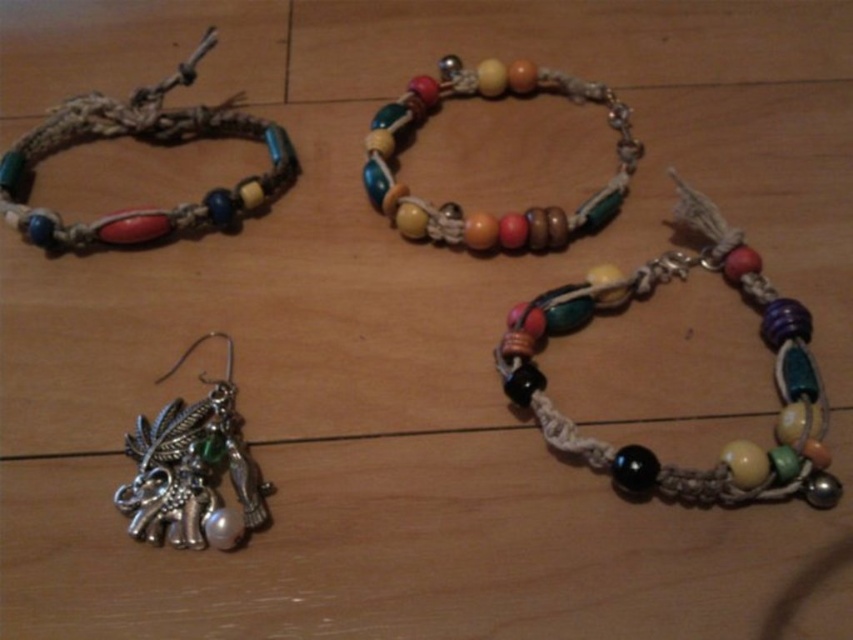
You are an artisan arranging jewelry on a wooden surface. You have a matte woven bracelet at upper left and a wooden beads necklace at upper center. Which of these items is narrower in width?

The matte woven bracelet at upper left is narrower in width compared to the wooden beads necklace at upper center.

You are organizing a jewelry display and need to arrange the matte woven bracelet at upper left and the wooden beads necklace at upper center based on their positions. Which item is located higher up in the image?

The matte woven bracelet at upper left is located higher up in the image than the wooden beads necklace at upper center because it is positioned above it.

You are a jewelry designer who needs to arrange these items for a photoshoot. The camera is positioned to capture both the matte woven bracelet at upper left and the wooden beads necklace at upper center. Given the spacing between them, would you need to adjust their positions to ensure they are within the camera frame?

The distance between the matte woven bracelet at upper left and the wooden beads necklace at upper center is 15.33 inches. Whether an adjustment is needed depends on the camera frame size, but the current spacing is already quite substantial. If the camera frame can accommodate this distance, no adjustment is necessary. However, if the frame is smaller, moving them closer might be required.